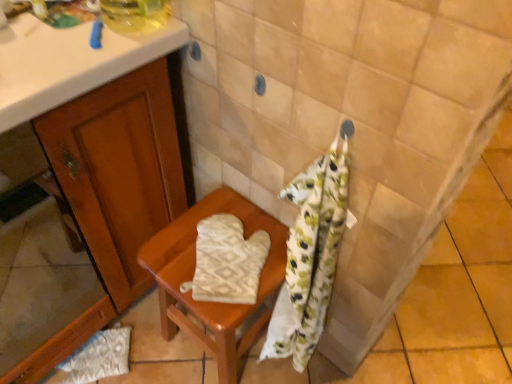
At what (x,y) coordinates should I click in order to perform the action: click on free point above white textured oven mitt at lower left (from a real-world perspective). Please return your answer as a coordinate pair (x, y). The image size is (512, 384). Looking at the image, I should click on (103, 358).